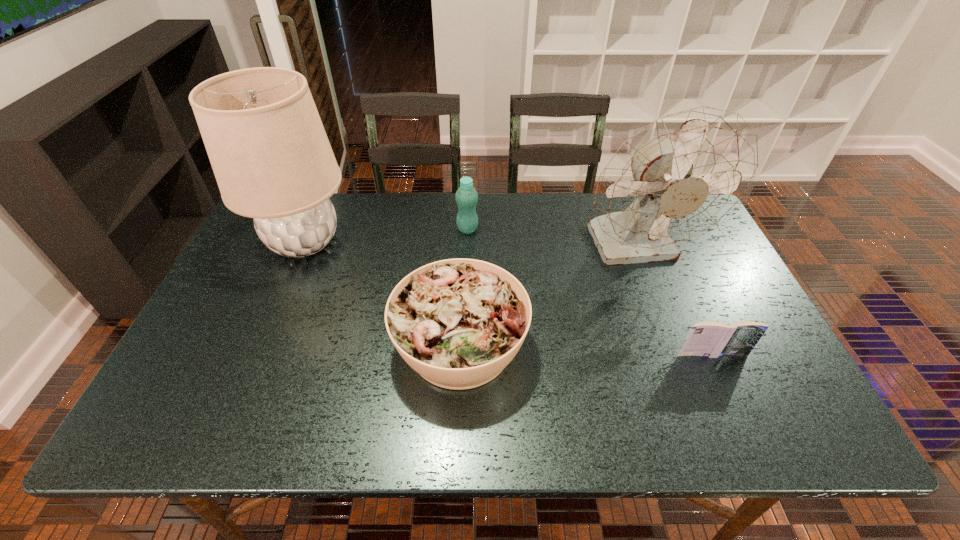
The image size is (960, 540). In order to click on fan in this screenshot , I will do `click(683, 175)`.

This screenshot has height=540, width=960. Find the location of `the leftmost object`. the leftmost object is located at coordinates (272, 160).

This screenshot has width=960, height=540. I want to click on water bottle, so click(466, 196).

You are a GUI agent. You are given a task and a screenshot of the screen. Output one action in this format:
    pyautogui.click(x=<x>, y=<y>)
    Task: Click on the second shortest object
    The height and width of the screenshot is (540, 960).
    Given the screenshot: What is the action you would take?
    point(459,322)

You are a GUI agent. You are given a task and a screenshot of the screen. Output one action in this format:
    pyautogui.click(x=<x>, y=<y>)
    Task: Click on the shortest object
    This screenshot has width=960, height=540.
    Given the screenshot: What is the action you would take?
    pyautogui.click(x=709, y=339)

I want to click on free point located in front of the fan to blow air, so click(693, 394).

At what (x,y) coordinates should I click in order to perform the action: click on vacant area situated 0.300m on the right of the lampshade. Please return your answer as a coordinate pair (x, y). The width and height of the screenshot is (960, 540). Looking at the image, I should click on (454, 242).

I want to click on vacant space situated 0.310m at the front cap of the water bottle, so click(x=465, y=313).

Identify the location of vacant region located 0.070m on the left of the second shortest object. (365, 345).

In order to click on free space located on the front cover of the book in this screenshot , I will do 732,400.